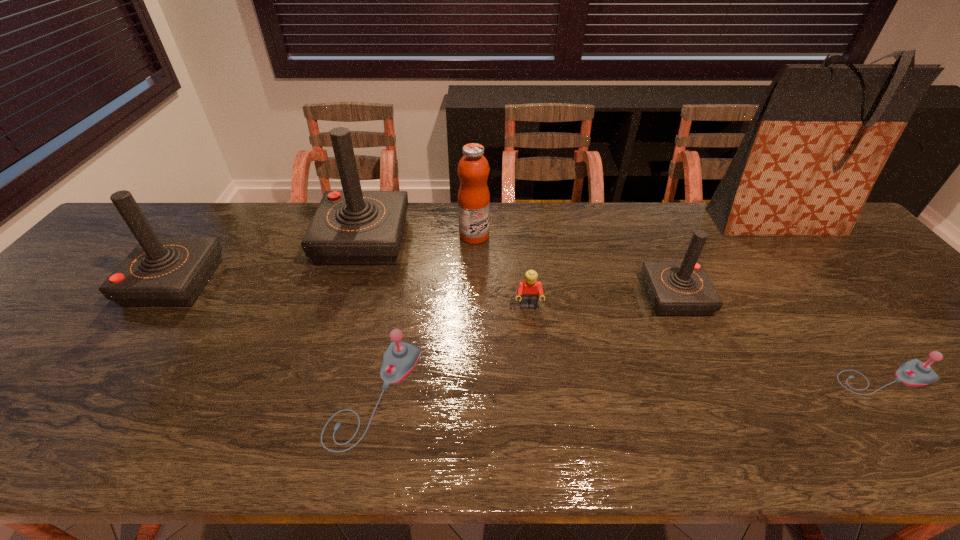
Where is `object positioned at the far right corner`? Image resolution: width=960 pixels, height=540 pixels. object positioned at the far right corner is located at coordinates (822, 133).

You are a GUI agent. You are given a task and a screenshot of the screen. Output one action in this format:
    pyautogui.click(x=<x>, y=<y>)
    Task: Click on the vacant region at the far edge of the desktop
    This screenshot has width=960, height=540.
    Given the screenshot: What is the action you would take?
    pyautogui.click(x=564, y=205)

At what (x,y) coordinates should I click in order to perform the action: click on free space at the near edge. Please return your answer as a coordinate pair (x, y). The height and width of the screenshot is (540, 960). Looking at the image, I should click on (36, 420).

This screenshot has height=540, width=960. Identify the location of free space at the left edge of the desktop. (58, 292).

The image size is (960, 540). What are the coordinates of `vacant space at the right edge` in the screenshot? It's located at (821, 255).

Where is `unoccupied area between the fifth object from left to right and the smaller gray joystick`? unoccupied area between the fifth object from left to right and the smaller gray joystick is located at coordinates (707, 342).

This screenshot has width=960, height=540. In order to click on blank region between the smaller gray joystick and the shopping bag in this screenshot , I will do `click(830, 301)`.

Find the location of a particular element. The image size is (960, 540). vacant area that lies between the fifth object from left to right and the leftmost red joystick is located at coordinates (351, 294).

You are a GUI agent. You are given a task and a screenshot of the screen. Output one action in this format:
    pyautogui.click(x=<x>, y=<y>)
    Task: Click on the vacant area that lies between the second shortest joystick and the second red joystick from right to left
    Image resolution: width=960 pixels, height=540 pixels.
    Given the screenshot: What is the action you would take?
    pyautogui.click(x=370, y=318)

Where is `vacant space in between the seventh shortest object and the bigger gray joystick`? The width and height of the screenshot is (960, 540). vacant space in between the seventh shortest object and the bigger gray joystick is located at coordinates (370, 318).